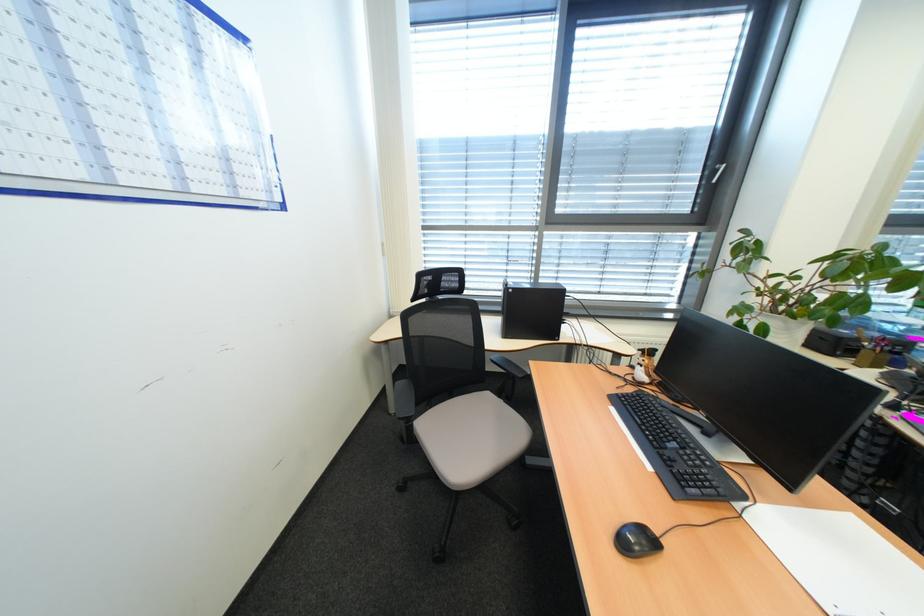
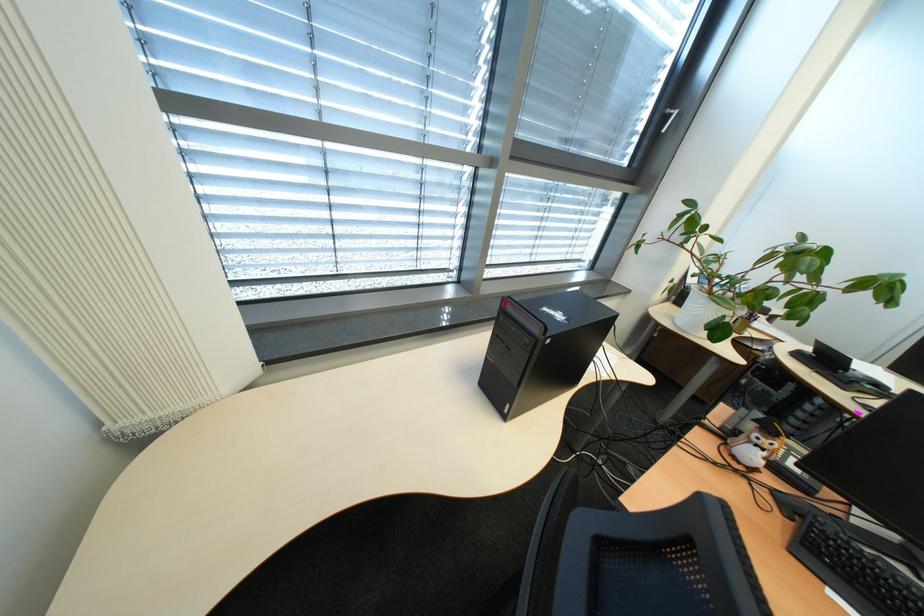
Where in the second image is the point corresponding to (x=653, y=362) from the first image?

(783, 446)